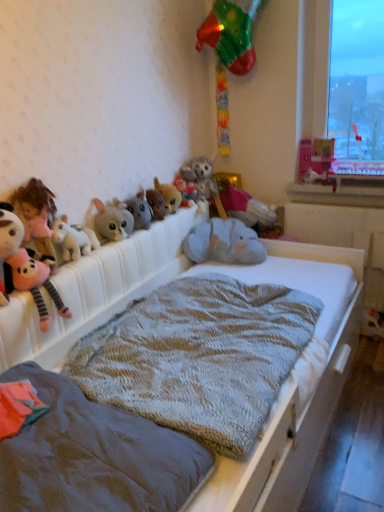
Question: Is pink plush toy at left, which is counted as the first toy, starting from the left, surrounding fluffy gray plush at center, the 7th toy viewed from the right?

Choices:
 (A) no
 (B) yes

Answer: (A)

Question: Considering the relative positions of pink plush toy at left, which is counted as the first toy, starting from the left, and fluffy gray plush at center, which appears as the fourth toy when viewed from the left, in the image provided, is pink plush toy at left, which is counted as the first toy, starting from the left, to the left of fluffy gray plush at center, which appears as the fourth toy when viewed from the left, from the viewer's perspective?

Choices:
 (A) yes
 (B) no

Answer: (A)

Question: From the image's perspective, is pink plush toy at left, acting as the tenth toy starting from the right, located above fluffy gray plush at center, which appears as the fourth toy when viewed from the left?

Choices:
 (A) no
 (B) yes

Answer: (A)

Question: Does pink plush toy at left, acting as the tenth toy starting from the right, have a lesser width compared to fluffy gray plush at center, the 7th toy viewed from the right?

Choices:
 (A) yes
 (B) no

Answer: (B)

Question: Can you see pink plush toy at left, which is counted as the first toy, starting from the left, touching fluffy gray plush at center, the 7th toy viewed from the right?

Choices:
 (A) yes
 (B) no

Answer: (B)

Question: Visually, is fluffy gray elephant at center, which is counted as the seventh toy, starting from the left, positioned to the left or to the right of white plush unicorn at left, which is the eighth toy in right-to-left order?

Choices:
 (A) left
 (B) right

Answer: (B)

Question: Relative to white plush unicorn at left, which is the eighth toy in right-to-left order, is fluffy gray elephant at center, which is the 4th toy from right to left, in front or behind?

Choices:
 (A) front
 (B) behind

Answer: (B)

Question: From a real-world perspective, is fluffy gray elephant at center, which is counted as the seventh toy, starting from the left, above or below white plush unicorn at left, which is the eighth toy in right-to-left order?

Choices:
 (A) above
 (B) below

Answer: (B)

Question: Does point (190, 185) appear closer or farther from the camera than point (62, 254)?

Choices:
 (A) farther
 (B) closer

Answer: (A)

Question: Relative to fluffy gray elephant at center, which is the 4th toy from right to left, is textured gray blanket at center, arranged as the 2th blanket when viewed from the front, in front or behind?

Choices:
 (A) behind
 (B) front

Answer: (B)

Question: In terms of width, does textured gray blanket at center, arranged as the 2th blanket when viewed from the front, look wider or thinner when compared to fluffy gray elephant at center, which is counted as the seventh toy, starting from the left?

Choices:
 (A) wide
 (B) thin

Answer: (A)

Question: Is point (198, 351) positioned closer to the camera than point (183, 182)?

Choices:
 (A) farther
 (B) closer

Answer: (B)

Question: From the image's perspective, is textured gray blanket at center, arranged as the 2th blanket when viewed from the front, located above or below fluffy gray elephant at center, which is counted as the seventh toy, starting from the left?

Choices:
 (A) below
 (B) above

Answer: (A)

Question: Is fluffy gray stuffed animal at center in front of or behind white plastic window sill at lower right in the image?

Choices:
 (A) front
 (B) behind

Answer: (B)

Question: Is point (190, 170) closer or farther from the camera than point (329, 198)?

Choices:
 (A) closer
 (B) farther

Answer: (A)